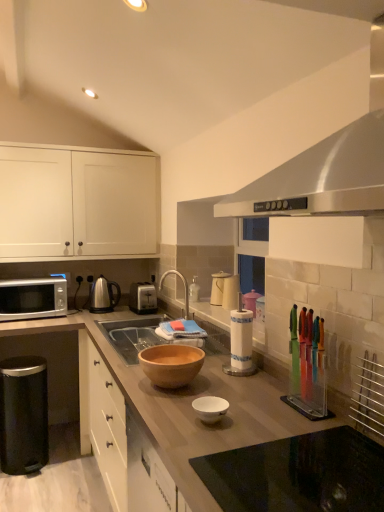
From the picture: Measure the distance between silver metallic microwave at left, the second countertop in the front-to-back sequence, and camera.

silver metallic microwave at left, the second countertop in the front-to-back sequence, is 8.34 feet from camera.

The image size is (384, 512). What do you see at coordinates (43, 325) in the screenshot? I see `silver metallic microwave at left, the 1th countertop in the top-to-bottom sequence` at bounding box center [43, 325].

The image size is (384, 512). What are the coordinates of `wooden bowl at center` in the screenshot? It's located at (131, 336).

You are a GUI agent. You are given a task and a screenshot of the screen. Output one action in this format:
    pyautogui.click(x=<x>, y=<y>)
    Task: Click on the white glossy bowl at center, which ranks as the second bowl in back-to-front order
    
    Given the screenshot: What is the action you would take?
    pyautogui.click(x=210, y=408)

Locate an element on the screen. matte silver faucet at center is located at coordinates (183, 284).

Is silver metallic microwave at left positioned beyond the bounds of satin silver toaster at center, placed as the fourth appliance when sorted from right to left?

silver metallic microwave at left lies outside satin silver toaster at center, placed as the fourth appliance when sorted from right to left,'s area.

From the picture: Considering the relative sizes of silver metallic microwave at left and satin silver toaster at center, placed as the fourth appliance when sorted from right to left, in the image provided, is silver metallic microwave at left smaller than satin silver toaster at center, placed as the fourth appliance when sorted from right to left,?

No.

Is silver metallic microwave at left positioned before satin silver toaster at center, acting as the 2th appliance starting from the left?

Yes, silver metallic microwave at left is in front of satin silver toaster at center, acting as the 2th appliance starting from the left.

Between point (51, 278) and point (146, 306), which one is positioned behind?

The point (51, 278) is more distant.

Is silver metallic microwave at left, the 1th countertop in the top-to-bottom sequence, aimed at black glass cooktop at lower center, the 1th countertop when ordered from bottom to top?

Yes.

From the image's perspective, is silver metallic microwave at left, marked as the 2th countertop in a right-to-left arrangement, beneath black glass cooktop at lower center, the 1th countertop when ordered from bottom to top?

Incorrect, from the image's perspective, silver metallic microwave at left, marked as the 2th countertop in a right-to-left arrangement, is higher than black glass cooktop at lower center, the 1th countertop when ordered from bottom to top.

Identify the location of countertop below the silver metallic microwave at left, the first countertop when ordered from left to right (from the image's perspective). The width and height of the screenshot is (384, 512). (298, 474).

Who is bigger, satin silver toaster at center, acting as the 2th appliance starting from the left, or black matte trash can at lower left, the fifth appliance when ordered from right to left?

With larger size is black matte trash can at lower left, the fifth appliance when ordered from right to left.

Does satin silver toaster at center, placed as the fourth appliance when sorted from right to left, contain black matte trash can at lower left, positioned as the 1th appliance in left-to-right order?

No, satin silver toaster at center, placed as the fourth appliance when sorted from right to left, does not contain black matte trash can at lower left, positioned as the 1th appliance in left-to-right order.

Is satin silver toaster at center, acting as the 2th appliance starting from the left, to the right of black matte trash can at lower left, the fifth appliance when ordered from right to left, from the viewer's perspective?

Yes.

Considering the relative sizes of satin silver toaster at center, placed as the fourth appliance when sorted from right to left, and black matte trash can at lower left, the fifth appliance when ordered from right to left, in the image provided, is satin silver toaster at center, placed as the fourth appliance when sorted from right to left, taller than black matte trash can at lower left, the fifth appliance when ordered from right to left,?

No, satin silver toaster at center, placed as the fourth appliance when sorted from right to left, is not taller than black matte trash can at lower left, the fifth appliance when ordered from right to left.

At what (x,y) coordinates should I click in order to perform the action: click on the 1st bowl to the right of the silver metallic microwave at left, counting from the anchor's position. Please return your answer as a coordinate pair (x, y). This screenshot has height=512, width=384. Looking at the image, I should click on (171, 364).

From the image's perspective, is silver metallic microwave at left located beneath wooden bowl at center, the 2th bowl when ordered from front to back?

No.

Is silver metallic microwave at left next to wooden bowl at center, the 2th bowl when ordered from front to back?

No, silver metallic microwave at left is not in contact with wooden bowl at center, the 2th bowl when ordered from front to back.

Considering the sizes of satin nickel tea pot at center and satin silver toaster at center, acting as the 2th appliance starting from the left, in the image, is satin nickel tea pot at center taller or shorter than satin silver toaster at center, acting as the 2th appliance starting from the left,?

In the image, satin nickel tea pot at center appears to be taller than satin silver toaster at center, acting as the 2th appliance starting from the left.

Is satin nickel tea pot at center turned away from satin silver toaster at center, acting as the 5th appliance starting from the front?

satin nickel tea pot at center does not have its back to satin silver toaster at center, acting as the 5th appliance starting from the front.

How distant is satin nickel tea pot at center from satin silver toaster at center, placed as the fourth appliance when sorted from right to left?

The distance of satin nickel tea pot at center from satin silver toaster at center, placed as the fourth appliance when sorted from right to left, is 10.29 inches.

Considering the sizes of objects satin nickel tea pot at center and satin silver toaster at center, acting as the 5th appliance starting from the front, in the image provided, who is smaller, satin nickel tea pot at center or satin silver toaster at center, acting as the 5th appliance starting from the front,?

satin nickel tea pot at center.

From a real-world perspective, who is located lower, black glass cooktop at lower center, the 2th countertop in the left-to-right sequence, or white glossy bowl at center, which ranks as the second bowl in back-to-front order?

black glass cooktop at lower center, the 2th countertop in the left-to-right sequence.

Considering the relative positions of black glass cooktop at lower center, placed as the first countertop when sorted from front to back, and white glossy bowl at center, which is the 1th bowl from front to back, in the image provided, is black glass cooktop at lower center, placed as the first countertop when sorted from front to back, to the left of white glossy bowl at center, which is the 1th bowl from front to back, from the viewer's perspective?

In fact, black glass cooktop at lower center, placed as the first countertop when sorted from front to back, is to the right of white glossy bowl at center, which is the 1th bowl from front to back.

Is point (363, 440) in front of point (207, 408)?

Yes, it is.

Are black glass cooktop at lower center, the 2th countertop positioned from the back, and white glossy bowl at center, which ranks as the second bowl in back-to-front order, far apart?

black glass cooktop at lower center, the 2th countertop positioned from the back, is actually quite close to white glossy bowl at center, which ranks as the second bowl in back-to-front order.

Considering their positions, is matte white kettle at center, the third appliance positioned from the left, located in front of or behind metallic silver rack at right, placed as the 5th appliance when sorted from left to right?

Visually, matte white kettle at center, the third appliance positioned from the left, is located behind metallic silver rack at right, placed as the 5th appliance when sorted from left to right.

Considering the sizes of objects matte white kettle at center, the fourth appliance in the front-to-back sequence, and metallic silver rack at right, placed as the 5th appliance when sorted from left to right, in the image provided, who is wider, matte white kettle at center, the fourth appliance in the front-to-back sequence, or metallic silver rack at right, placed as the 5th appliance when sorted from left to right,?

matte white kettle at center, the fourth appliance in the front-to-back sequence, is wider.

Is matte white kettle at center, the fourth appliance in the front-to-back sequence, situated inside metallic silver rack at right, the first appliance positioned from the right, or outside?

The correct answer is: outside.

Which is behind, point (219, 295) or point (367, 371)?

The point (219, 295) is behind.

This screenshot has height=512, width=384. In the image, there is a satin silver toaster at center, acting as the 2th appliance starting from the left. Identify the location of kitchen appliance above it (from the image's perspective). (33, 298).

Where is `countertop on the right of silver metallic microwave at left, the 1th countertop in the top-to-bottom sequence`? This screenshot has height=512, width=384. countertop on the right of silver metallic microwave at left, the 1th countertop in the top-to-bottom sequence is located at coordinates (298, 474).

When comparing their distances from black glass cooktop at lower center, the 1th countertop in the right-to-left sequence, does satin silver toaster at center, acting as the 2th appliance starting from the left, or translucent plastic knife block at right, the fourth appliance in the back-to-front sequence, seem closer?

The object closer to black glass cooktop at lower center, the 1th countertop in the right-to-left sequence, is translucent plastic knife block at right, the fourth appliance in the back-to-front sequence.

Which object lies nearer to the anchor point matte white kettle at center, placed as the 2th appliance when sorted from back to front, silver metallic microwave at left, the first countertop when ordered from left to right, or silver metallic microwave at left?

silver metallic microwave at left, the first countertop when ordered from left to right.

From the image, which object appears to be nearer to silver metallic microwave at left, satin silver exhaust hood at upper center or matte white kettle at center, placed as the 2th appliance when sorted from back to front?

Based on the image, matte white kettle at center, placed as the 2th appliance when sorted from back to front, appears to be nearer to silver metallic microwave at left.

From the picture: From the image, which object appears to be farther from matte silver faucet at center, silver metallic microwave at left, the second countertop in the front-to-back sequence, or white matte cabinet at upper left?

white matte cabinet at upper left is positioned further to the anchor matte silver faucet at center.

Looking at the image, which one is located closer to white matte cabinet at upper left, matte silver faucet at center or satin silver exhaust hood at upper center?

Based on the image, matte silver faucet at center appears to be nearer to white matte cabinet at upper left.

Considering their positions, is wooden bowl at center, the 2th bowl when ordered from front to back, positioned closer to satin silver toaster at center, acting as the 2th appliance starting from the left, than silver metallic microwave at left?

Among the two, silver metallic microwave at left is located nearer to satin silver toaster at center, acting as the 2th appliance starting from the left.

From the picture: Considering their positions, is translucent plastic knife block at right, which is counted as the second appliance, starting from the right, positioned further to wooden bowl at center than black glass cooktop at lower center, the 1th countertop when ordered from bottom to top?

Based on the image, black glass cooktop at lower center, the 1th countertop when ordered from bottom to top, appears to be further to wooden bowl at center.

In the scene shown: Based on their spatial positions, is satin silver toaster at center, acting as the 5th appliance starting from the front, or silver metallic microwave at left, the 2th countertop from the bottom, closer to black glass cooktop at lower center, placed as the first countertop when sorted from front to back?

satin silver toaster at center, acting as the 5th appliance starting from the front.

Find the location of `countertop between wooden bowl at center, the 2th bowl when ordered from front to back, and satin nickel tea pot at center, along the z-axis`. countertop between wooden bowl at center, the 2th bowl when ordered from front to back, and satin nickel tea pot at center, along the z-axis is located at coordinates (43, 325).

Locate an element on the screen. This screenshot has width=384, height=512. sink between black glass cooktop at lower center, which is the 2th countertop in top-to-bottom order, and silver metallic microwave at left, along the z-axis is located at coordinates (131, 336).

The height and width of the screenshot is (512, 384). I want to click on sink between silver metallic microwave at left, marked as the 2th countertop in a right-to-left arrangement, and matte silver faucet at center, so click(131, 336).

This screenshot has height=512, width=384. What are the coordinates of `tea pot between white matte cabinet at upper left and satin silver toaster at center, acting as the 5th appliance starting from the front, from top to bottom` in the screenshot? It's located at (103, 295).